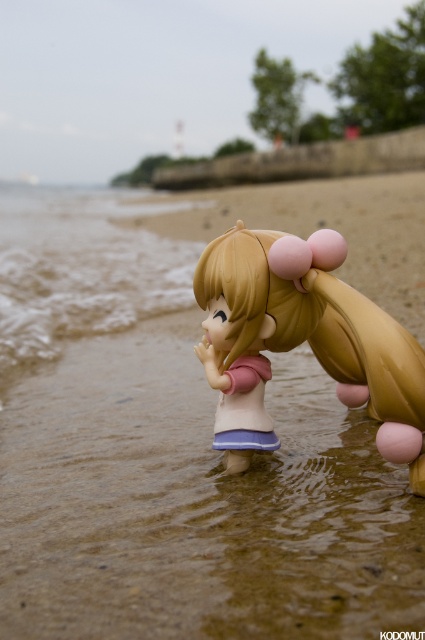
You are a photographer trying to capture a closeup shot of the satin gold hair at center and the clear water at lower left. Your camera has a maximum focus range of 25 inches. Can you focus on both objects simultaneously?

The satin gold hair at center is 26.32 inches away from the clear water at lower left, so the distance between them exceeds the camera maximum focus range of 25 inches. Therefore, you cannot focus on both objects simultaneously.

You are a photographer trying to capture the perfect shot of the sandy brown beach at center and the satin gold hair at center. Since you want to focus on the beach, which object should you adjust your camera to focus on first, considering their heights?

The sandy brown beach at center has a greater height compared to the satin gold hair at center, so you should focus on the sandy brown beach at center first as it is taller.

You are a photographer trying to capture the beach scene. You notice two points in the image at coordinates point [261,253] and point [133,312]. Which point is nearer to your camera lens?

Point [261,253] is closer to the camera than point [133,312].